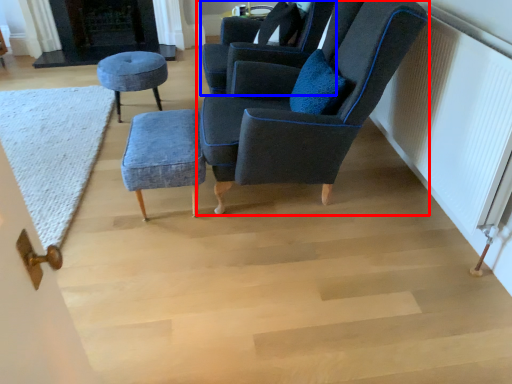
Question: Which of the following is the farthest to the observer, chair (highlighted by a red box) or chair (highlighted by a blue box)?

Choices:
 (A) chair
 (B) chair

Answer: (B)